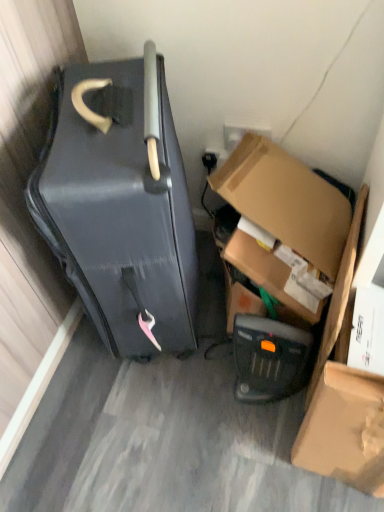
Question: From the image's perspective, is matte brown cardboard box at lower right located above cardboard box at lower right?

Choices:
 (A) no
 (B) yes

Answer: (A)

Question: From a real-world perspective, is matte brown cardboard box at lower right on cardboard box at lower right?

Choices:
 (A) yes
 (B) no

Answer: (B)

Question: From a real-world perspective, is matte brown cardboard box at lower right physically below cardboard box at lower right?

Choices:
 (A) yes
 (B) no

Answer: (A)

Question: Is matte brown cardboard box at lower right positioned far away from cardboard box at lower right?

Choices:
 (A) no
 (B) yes

Answer: (A)

Question: Could you tell me if matte brown cardboard box at lower right is facing cardboard box at lower right?

Choices:
 (A) yes
 (B) no

Answer: (B)

Question: Is matte brown cardboard box at lower right outside cardboard box at lower right?

Choices:
 (A) no
 (B) yes

Answer: (B)

Question: Would you say matte brown cardboard box at lower right is part of black plastic heater at lower center's contents?

Choices:
 (A) no
 (B) yes

Answer: (A)

Question: Is the position of black plastic heater at lower center more distant than that of matte brown cardboard box at lower right?

Choices:
 (A) no
 (B) yes

Answer: (B)

Question: From a real-world perspective, is black plastic heater at lower center positioned over matte brown cardboard box at lower right based on gravity?

Choices:
 (A) no
 (B) yes

Answer: (A)

Question: Is black plastic heater at lower center not near matte brown cardboard box at lower right?

Choices:
 (A) no
 (B) yes

Answer: (A)

Question: Is black plastic heater at lower center located outside matte brown cardboard box at lower right?

Choices:
 (A) no
 (B) yes

Answer: (B)

Question: From the image's perspective, is black plastic heater at lower center above matte brown cardboard box at lower right?

Choices:
 (A) no
 (B) yes

Answer: (B)

Question: Is cardboard box at lower right taller than matte black suitcase at left?

Choices:
 (A) yes
 (B) no

Answer: (B)